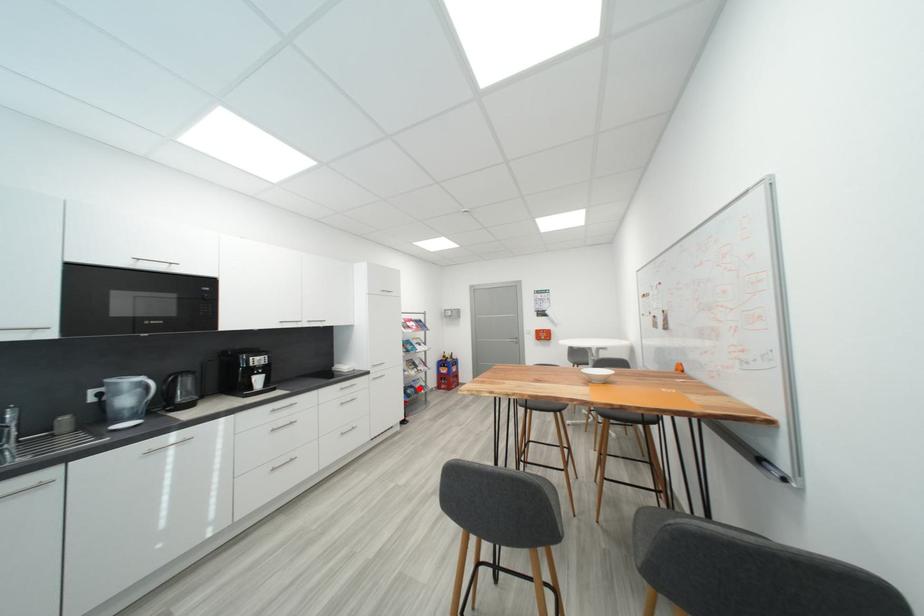
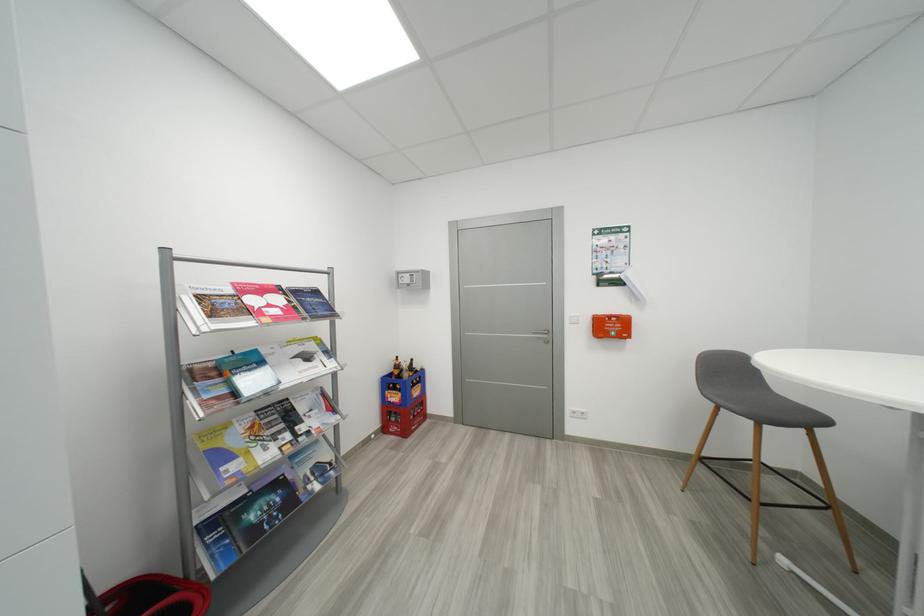
In the second image, find the point that corresponds to the highlighted location in the first image.

(285, 485)